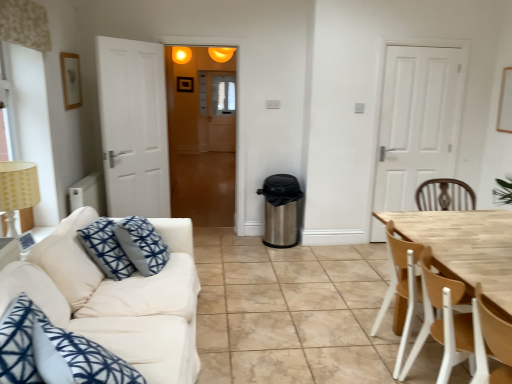
What do you see at coordinates (17, 190) in the screenshot? Image resolution: width=512 pixels, height=384 pixels. I see `beige fabric lampshade at left` at bounding box center [17, 190].

At what (x,y) coordinates should I click in order to perform the action: click on wooden chair at right, which is the 2th chair from front to back. Please return your answer as a coordinate pair (x, y). The height and width of the screenshot is (384, 512). Looking at the image, I should click on (431, 308).

How much space does light brown wood chair at right, which is counted as the 1th chair, starting from the front, occupy horizontally?

It is 19.21 inches.

I want to click on translucent wooden door at center, so click(x=202, y=138).

This screenshot has width=512, height=384. Identify the location of matte orange light fixture at upper center. (181, 54).

Is wooden chair at right, which is the 2th chair from front to back, located outside matte orange light fixture at upper center?

Indeed, wooden chair at right, which is the 2th chair from front to back, is completely outside matte orange light fixture at upper center.

Is wooden chair at right, which is the 2th chair from front to back, wider or thinner than matte orange light fixture at upper center?

In the image, wooden chair at right, which is the 2th chair from front to back, appears to be wider than matte orange light fixture at upper center.

I want to click on chair that is the 1st object located in front of the matte orange light fixture at upper center, so click(x=431, y=308).

Which object is positioned more to the right, light brown wood chair at right, which is counted as the 1th chair, starting from the front, or wooden chair at right, which is the 2th chair from front to back?

Positioned to the right is light brown wood chair at right, which is counted as the 1th chair, starting from the front.

Considering the sizes of objects light brown wood chair at right, which is counted as the 1th chair, starting from the front, and wooden chair at right, which is the first chair in back-to-front order, in the image provided, who is wider, light brown wood chair at right, which is counted as the 1th chair, starting from the front, or wooden chair at right, which is the first chair in back-to-front order,?

wooden chair at right, which is the first chair in back-to-front order, is wider.

Looking at this image, between light brown wood chair at right, which is counted as the 1th chair, starting from the front, and wooden chair at right, which is the 2th chair from front to back, which one has smaller size?

With smaller size is light brown wood chair at right, which is counted as the 1th chair, starting from the front.

From a real-world perspective, is wooden chair at right, which is the first chair in back-to-front order, under beige fabric lampshade at left?

Indeed, from a real-world perspective, wooden chair at right, which is the first chair in back-to-front order, is positioned beneath beige fabric lampshade at left.

Who is bigger, wooden chair at right, which is the 2th chair from front to back, or beige fabric lampshade at left?

wooden chair at right, which is the 2th chair from front to back, is bigger.

Can beige fabric lampshade at left be found inside wooden chair at right, which is the 2th chair from front to back?

No, beige fabric lampshade at left is not surrounded by wooden chair at right, which is the 2th chair from front to back.

From the image's perspective, which is below, wooden chair at right, which is the first chair in back-to-front order, or beige fabric lampshade at left?

wooden chair at right, which is the first chair in back-to-front order, appears lower in the image.

Is beige fabric lampshade at left not near translucent wooden door at center?

Indeed, beige fabric lampshade at left is not near translucent wooden door at center.

Is point (11, 223) closer to viewer compared to point (221, 67)?

Yes, point (11, 223) is closer to viewer.

Would you say beige fabric lampshade at left is inside or outside translucent wooden door at center?

beige fabric lampshade at left exists outside the volume of translucent wooden door at center.

Between point (211, 125) and point (429, 327), which one is positioned behind?

The point (211, 125) is more distant.

Is translucent wooden door at center bigger than light brown wood chair at right, the second chair from the back?

Yes.

How much distance is there between translucent wooden door at center and light brown wood chair at right, which is counted as the 1th chair, starting from the front?

translucent wooden door at center is 13.02 feet from light brown wood chair at right, which is counted as the 1th chair, starting from the front.

Considering the points (450, 338) and (185, 47), which point is in front, point (450, 338) or point (185, 47)?

Positioned in front is point (450, 338).

From a real-world perspective, who is located lower, light brown wood chair at right, which is counted as the 1th chair, starting from the front, or matte orange light fixture at upper center?

From a 3D spatial view, light brown wood chair at right, which is counted as the 1th chair, starting from the front, is below.

Is white matte door at right far away from matte orange light fixture at upper center?

white matte door at right is far away from matte orange light fixture at upper center.

Is white matte door at right facing towards matte orange light fixture at upper center?

No.

From the image's perspective, which object appears higher, white matte door at right or matte orange light fixture at upper center?

matte orange light fixture at upper center is shown above in the image.

Which object is further away from the camera taking this photo, white matte door at right or matte orange light fixture at upper center?

matte orange light fixture at upper center is behind.

This screenshot has width=512, height=384. I want to click on the 1st chair in front of the matte orange light fixture at upper center, so click(x=431, y=308).

Identify the location of chair that is on the right side of wooden chair at right, which is the 2th chair from front to back. The image size is (512, 384). (443, 322).

Based on their spatial positions, is matte orange light fixture at upper center or beige fabric lampshade at left further from translucent wooden door at center?

beige fabric lampshade at left.

Estimate the real-world distances between objects in this image. Which object is closer to beige fabric lampshade at left, white fabric couch at left or wooden chair at right, which is the first chair in back-to-front order?

white fabric couch at left lies closer to beige fabric lampshade at left than the other object.

From the image, which object appears to be nearer to wooden chair at right, which is the 2th chair from front to back, beige fabric lampshade at left or matte orange light fixture at upper center?

The object closer to wooden chair at right, which is the 2th chair from front to back, is beige fabric lampshade at left.

Which object lies nearer to the anchor point wooden chair at right, which is the 2th chair from front to back, white matte door at right or translucent wooden door at center?

white matte door at right.

From the image, which object appears to be nearer to translucent wooden door at center, white fabric couch at left or matte orange light fixture at upper center?

matte orange light fixture at upper center is closer to translucent wooden door at center.

Which object lies further to the anchor point matte orange light fixture at upper center, light brown wood chair at right, the second chair from the back, or white matte door at right?

light brown wood chair at right, the second chair from the back, lies further to matte orange light fixture at upper center than the other object.

When comparing their distances from light brown wood chair at right, the second chair from the back, does wooden chair at right, which is the 2th chair from front to back, or translucent wooden door at center seem closer?

Among the two, wooden chair at right, which is the 2th chair from front to back, is located nearer to light brown wood chair at right, the second chair from the back.

From the image, which object appears to be nearer to translucent wooden door at center, white matte door at right or matte orange light fixture at upper center?

The object closer to translucent wooden door at center is matte orange light fixture at upper center.

The height and width of the screenshot is (384, 512). In order to click on glass door positioned between wooden chair at right, which is the 2th chair from front to back, and matte orange light fixture at upper center from near to far in this screenshot , I will do `click(202, 138)`.

Where is `studio couch situated between beige fabric lampshade at left and white matte door at right from left to right`? The image size is (512, 384). studio couch situated between beige fabric lampshade at left and white matte door at right from left to right is located at coordinates (117, 298).

Locate an element on the screen. glass door located between beige fabric lampshade at left and light brown wood chair at right, the second chair from the back, in the left-right direction is located at coordinates (202, 138).

Where is `door positioned between white fabric couch at left and translucent wooden door at center from near to far`? Image resolution: width=512 pixels, height=384 pixels. door positioned between white fabric couch at left and translucent wooden door at center from near to far is located at coordinates (417, 120).